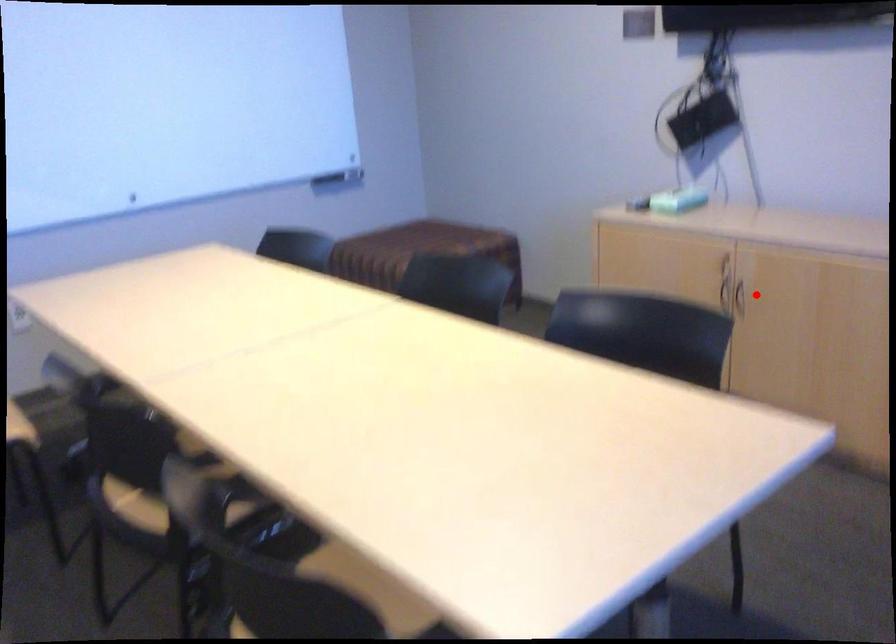
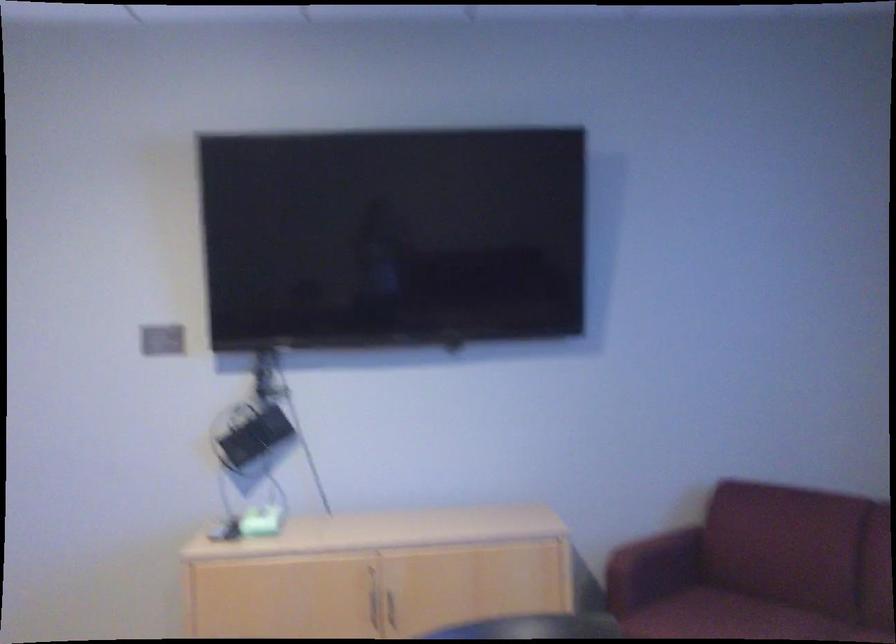
Question: I am providing you with two images of the same scene from different viewpoints. A red point is marked on the first image. Can you still see the location of the red point in image 2?

Choices:
 (A) Yes
 (B) No

Answer: (A)